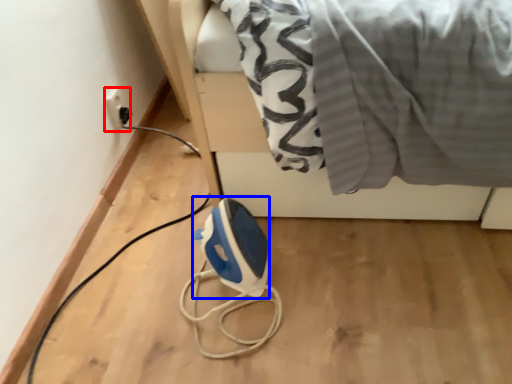
Question: Which object is further to the camera taking this photo, electric outlet (highlighted by a red box) or appliance (highlighted by a blue box)?

Choices:
 (A) electric outlet
 (B) appliance

Answer: (A)